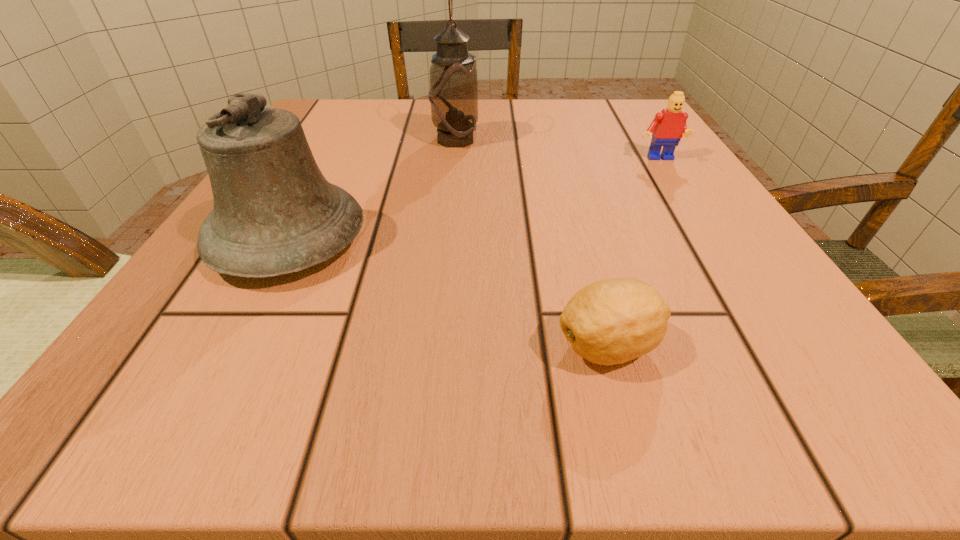
This screenshot has width=960, height=540. Find the location of `vacant space at the left edge`. vacant space at the left edge is located at coordinates (274, 303).

Image resolution: width=960 pixels, height=540 pixels. In the image, there is a desktop. In order to click on vacant space at the right edge in this screenshot , I will do `click(665, 188)`.

Find the location of a particular element. The height and width of the screenshot is (540, 960). vacant space at the far left corner of the desktop is located at coordinates click(307, 119).

You are a GUI agent. You are given a task and a screenshot of the screen. Output one action in this format:
    pyautogui.click(x=<x>, y=<y>)
    Task: Click on the vacant area at the near left corner
    The height and width of the screenshot is (540, 960).
    Given the screenshot: What is the action you would take?
    pyautogui.click(x=120, y=410)

Locate an element on the screen. free space at the far right corner of the desktop is located at coordinates (643, 101).

The width and height of the screenshot is (960, 540). I want to click on free space at the near right corner of the desktop, so coord(800,369).

At what (x,y) coordinates should I click in order to perform the action: click on vacant area that lies between the leftmost object and the second shortest object. Please return your answer as a coordinate pair (x, y). Looking at the image, I should click on (474, 200).

This screenshot has width=960, height=540. I want to click on empty location between the tallest object and the bell, so click(x=372, y=190).

The height and width of the screenshot is (540, 960). I want to click on free spot between the farthest object and the rightmost object, so click(x=557, y=150).

Locate an element on the screen. free point between the Lego and the second nearest object is located at coordinates pos(474,200).